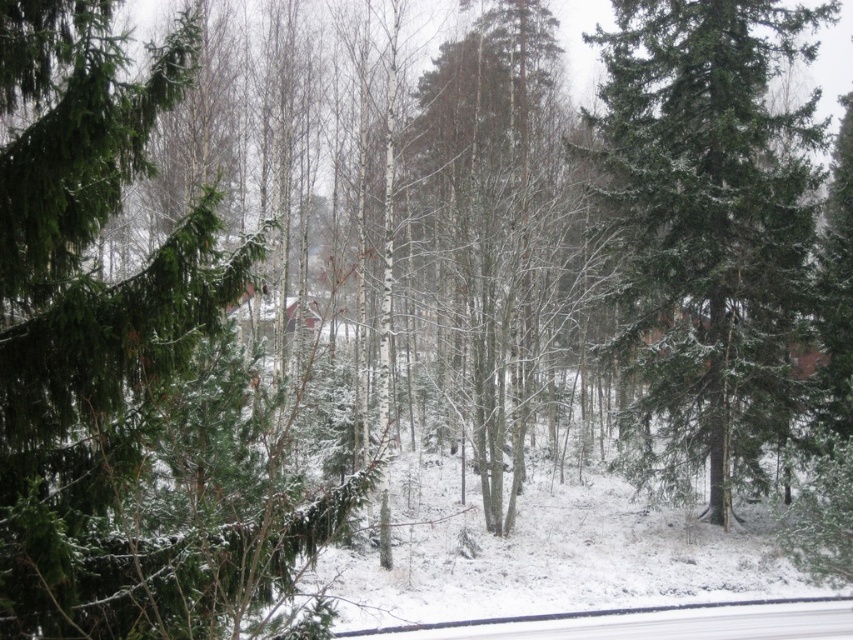
Question: Observing the image, what is the correct spatial positioning of green matte tree at left in reference to green matte tree at center?

Choices:
 (A) above
 (B) below

Answer: (B)

Question: Observing the image, what is the correct spatial positioning of green matte tree at left in reference to green matte tree at center?

Choices:
 (A) below
 (B) above

Answer: (A)

Question: Which point is closer to the camera taking this photo?

Choices:
 (A) (41, 372)
 (B) (665, 412)

Answer: (A)

Question: Which point appears closest to the camera in this image?

Choices:
 (A) (112, 141)
 (B) (666, 380)

Answer: (A)

Question: Considering the relative positions of green matte tree at left and green matte tree at center in the image provided, where is green matte tree at left located with respect to green matte tree at center?

Choices:
 (A) left
 (B) right

Answer: (A)